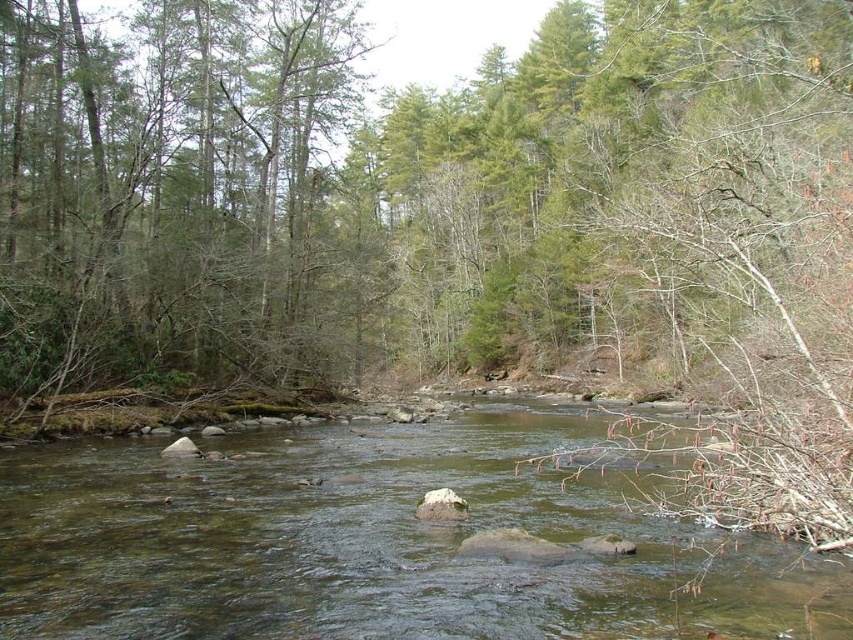
Question: Is green mossy rocks at center closer to camera compared to bare branches at right?

Choices:
 (A) no
 (B) yes

Answer: (B)

Question: Is the position of green mossy rocks at center less distant than that of bare branches at right?

Choices:
 (A) no
 (B) yes

Answer: (B)

Question: Is green mossy rocks at center further to camera compared to bare branches at right?

Choices:
 (A) yes
 (B) no

Answer: (B)

Question: Which point appears farthest from the camera in this image?

Choices:
 (A) (810, 445)
 (B) (32, 627)

Answer: (A)